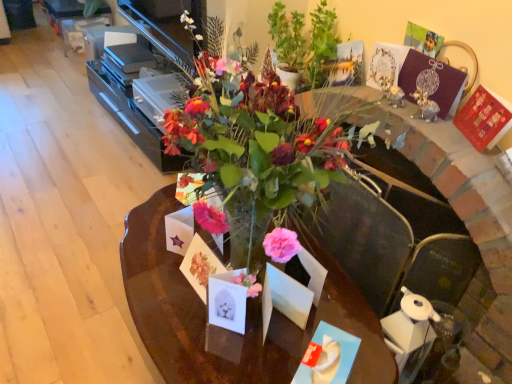
Locate an element on the screen. Image resolution: width=512 pixels, height=384 pixels. wooden table at center is located at coordinates pyautogui.click(x=227, y=330).

The height and width of the screenshot is (384, 512). What do you see at coordinates (227, 330) in the screenshot?
I see `wooden table at center` at bounding box center [227, 330].

Find the location of a particular element. wooden table at center is located at coordinates (227, 330).